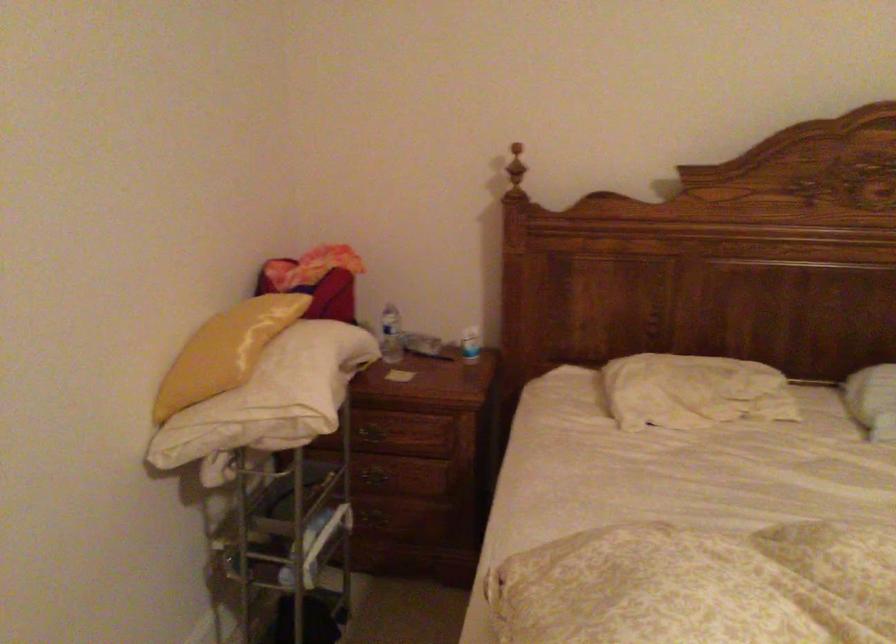
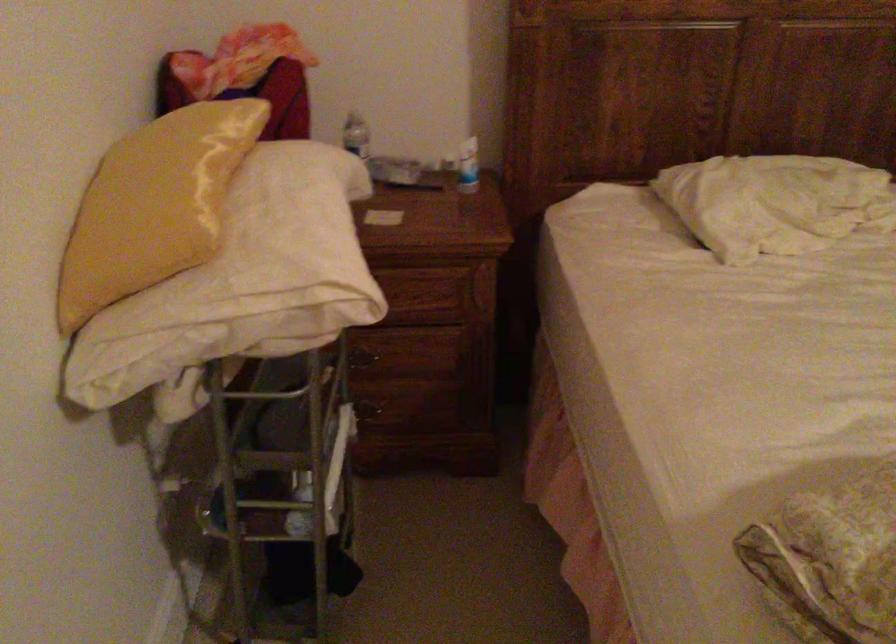
Question: The first image is from the beginning of the video and the second image is from the end. How did the camera likely rotate when shooting the video?

Choices:
 (A) Left
 (B) Right
 (C) Up
 (D) Down

Answer: (D)